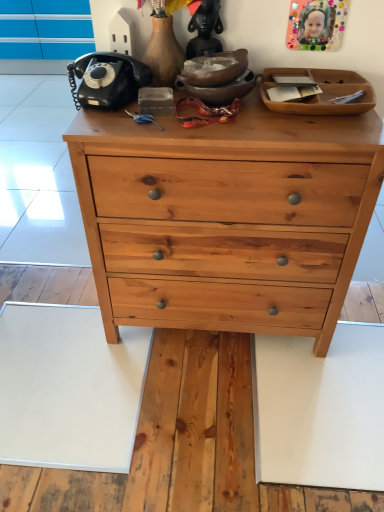
Where is `matte black statue at upper center`? This screenshot has width=384, height=512. matte black statue at upper center is located at coordinates (205, 30).

This screenshot has height=512, width=384. What do you see at coordinates (205, 30) in the screenshot?
I see `matte black statue at upper center` at bounding box center [205, 30].

The width and height of the screenshot is (384, 512). What do you see at coordinates (226, 218) in the screenshot?
I see `natural wood chest of drawers at center` at bounding box center [226, 218].

The height and width of the screenshot is (512, 384). Find the location of `natural wood chest of drawers at center`. natural wood chest of drawers at center is located at coordinates (226, 218).

In order to face natural wood chest of drawers at center, should I rotate leftwards or rightwards?

Turn right by 3.572 degrees to look at natural wood chest of drawers at center.

Find the location of a particular element. This screenshot has height=512, width=384. matte black statue at upper center is located at coordinates (205, 30).

Which is more to the left, natural wood chest of drawers at center or matte black statue at upper center?

matte black statue at upper center is more to the left.

Between natural wood chest of drawers at center and matte black statue at upper center, which one is positioned in front?

natural wood chest of drawers at center.

Is point (271, 135) positioned after point (206, 42)?

No, (271, 135) is in front of (206, 42).

From the image's perspective, which one is positioned higher, natural wood chest of drawers at center or matte black statue at upper center?

matte black statue at upper center appears higher in the image.

From a real-world perspective, which object stands above the other?

matte black statue at upper center.

Which object is thinner, natural wood chest of drawers at center or matte black statue at upper center?

matte black statue at upper center.

Considering the sizes of natural wood chest of drawers at center and matte black statue at upper center in the image, is natural wood chest of drawers at center taller or shorter than matte black statue at upper center?

In the image, natural wood chest of drawers at center appears to be taller than matte black statue at upper center.

Who is smaller, natural wood chest of drawers at center or matte black statue at upper center?

matte black statue at upper center.

Is natural wood chest of drawers at center outside of matte black statue at upper center?

natural wood chest of drawers at center is positioned outside matte black statue at upper center.

Would you say natural wood chest of drawers at center is a long distance from matte black statue at upper center?

No, natural wood chest of drawers at center is not far from matte black statue at upper center.

In the scene shown: Is natural wood chest of drawers at center facing away from matte black statue at upper center?

natural wood chest of drawers at center is not turned away from matte black statue at upper center.

Measure the distance from natural wood chest of drawers at center to matte black statue at upper center.

55.34 centimeters.

Image resolution: width=384 pixels, height=512 pixels. Find the location of `toy that appears above the natural wood chest of drawers at center (from the image's perspective)`. toy that appears above the natural wood chest of drawers at center (from the image's perspective) is located at coordinates (205, 30).

Considering the relative positions of matte black statue at upper center and natural wood chest of drawers at center in the image provided, is matte black statue at upper center to the right of natural wood chest of drawers at center from the viewer's perspective?

No, matte black statue at upper center is not to the right of natural wood chest of drawers at center.

Which is in front, matte black statue at upper center or natural wood chest of drawers at center?

natural wood chest of drawers at center.

Which is nearer, (203, 14) or (174, 266)?

Clearly, point (203, 14) is closer to the camera than point (174, 266).

From the image's perspective, is matte black statue at upper center beneath natural wood chest of drawers at center?

No, from the image's perspective, matte black statue at upper center is not beneath natural wood chest of drawers at center.

From a real-world perspective, is matte black statue at upper center positioned over natural wood chest of drawers at center based on gravity?

Yes, from a real-world perspective, matte black statue at upper center is above natural wood chest of drawers at center.

Does matte black statue at upper center have a lesser width compared to natural wood chest of drawers at center?

Yes, matte black statue at upper center is thinner than natural wood chest of drawers at center.

Is matte black statue at upper center taller or shorter than natural wood chest of drawers at center?

matte black statue at upper center is shorter than natural wood chest of drawers at center.

Considering the relative sizes of matte black statue at upper center and natural wood chest of drawers at center in the image provided, is matte black statue at upper center smaller than natural wood chest of drawers at center?

Correct, matte black statue at upper center occupies less space than natural wood chest of drawers at center.

Is matte black statue at upper center completely or partially outside of natural wood chest of drawers at center?

Yes.

Looking at this image, is matte black statue at upper center far from natural wood chest of drawers at center?

matte black statue at upper center is near natural wood chest of drawers at center, not far away.

Does matte black statue at upper center turn towards natural wood chest of drawers at center?

No, matte black statue at upper center is not oriented towards natural wood chest of drawers at center.

Where is `toy above the natural wood chest of drawers at center (from the image's perspective)`? The width and height of the screenshot is (384, 512). toy above the natural wood chest of drawers at center (from the image's perspective) is located at coordinates (205, 30).

Locate an element on the screen. Image resolution: width=384 pixels, height=512 pixels. toy above the natural wood chest of drawers at center (from the image's perspective) is located at coordinates [205, 30].

This screenshot has width=384, height=512. I want to click on chest of drawers that appears on the right of matte black statue at upper center, so click(x=226, y=218).